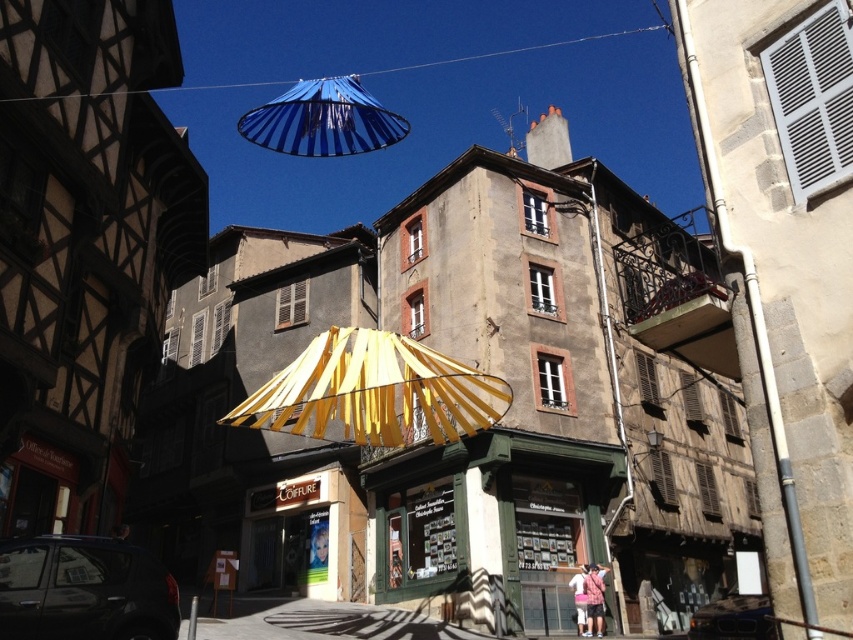
You are a tourist holding a yellow fabric umbrella at center and want to take a photo under the blue striped canopy at upper center. Can you fit both objects in the frame without moving the camera?

The yellow fabric umbrella at center is smaller than the blue striped canopy at upper center, so if you position the camera to include the larger blue striped canopy at upper center, the smaller yellow fabric umbrella at center should also fit in the frame without needing to move the camera.

You are a tourist standing on the sidewalk in front of the green wooden shop at center and the yellow fabric umbrella at center. You want to take a photo of both objects in the same frame. Which object should you position closer to the camera to include both in your photo?

The green wooden shop at center is much taller than the yellow fabric umbrella at center. To include both in the same frame, position the yellow fabric umbrella at center closer to the camera so that its smaller size balances with the taller shop in the background.